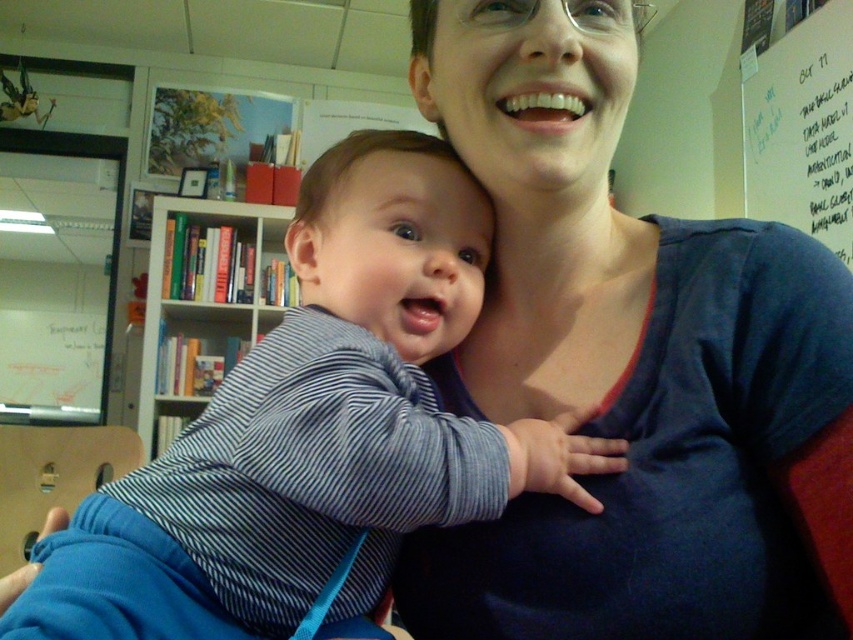
Does point (598, 554) come closer to viewer compared to point (793, 118)?

Yes, point (598, 554) is closer to viewer.

Between blue cotton shirt at center and white dry erase board at upper right, which one appears on the left side from the viewer's perspective?

From the viewer's perspective, blue cotton shirt at center appears more on the left side.

Which is behind, point (630, 250) or point (843, 84)?

The point (843, 84) is behind.

The height and width of the screenshot is (640, 853). Find the location of `blue cotton shirt at center`. blue cotton shirt at center is located at coordinates (630, 365).

Is white dry erase board at upper right smaller than hardcover books at left?

Correct, white dry erase board at upper right occupies less space than hardcover books at left.

Can you confirm if white dry erase board at upper right is bigger than hardcover books at left?

Incorrect, white dry erase board at upper right is not larger than hardcover books at left.

This screenshot has width=853, height=640. Find the location of `white dry erase board at upper right`. white dry erase board at upper right is located at coordinates (802, 129).

Find the location of a particular element. The image size is (853, 640). white dry erase board at upper right is located at coordinates (802, 129).

Is striped cotton shirt at center to the left of hardcover books at left from the viewer's perspective?

In fact, striped cotton shirt at center is to the right of hardcover books at left.

Which is above, striped cotton shirt at center or hardcover books at left?

hardcover books at left is above.

Find the location of a particular element. The image size is (853, 640). striped cotton shirt at center is located at coordinates (355, 397).

Image resolution: width=853 pixels, height=640 pixels. Find the location of `striped cotton shirt at center`. striped cotton shirt at center is located at coordinates pyautogui.click(x=355, y=397).